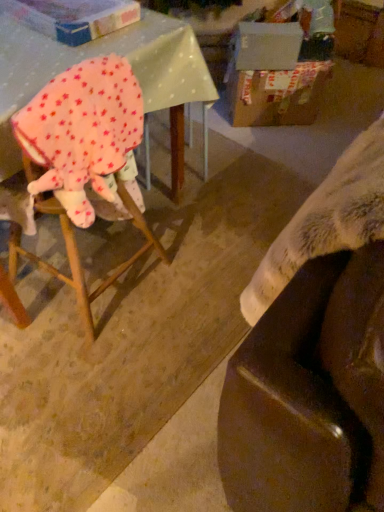
Question: Considering the relative sizes of wooden chair at left and fluffy white blanket at lower right in the image provided, is wooden chair at left wider than fluffy white blanket at lower right?

Choices:
 (A) yes
 (B) no

Answer: (A)

Question: From a real-world perspective, is wooden chair at left located beneath fluffy white blanket at lower right?

Choices:
 (A) no
 (B) yes

Answer: (B)

Question: Is fluffy white blanket at lower right surrounded by wooden chair at left?

Choices:
 (A) no
 (B) yes

Answer: (A)

Question: Can you confirm if wooden chair at left is positioned to the right of fluffy white blanket at lower right?

Choices:
 (A) yes
 (B) no

Answer: (B)

Question: From the image's perspective, would you say wooden chair at left is positioned over fluffy white blanket at lower right?

Choices:
 (A) yes
 (B) no

Answer: (A)

Question: Looking at the image, does pink fleece blanket at left seem bigger or smaller compared to wooden chair at left?

Choices:
 (A) small
 (B) big

Answer: (A)

Question: Is pink fleece blanket at left situated inside wooden chair at left or outside?

Choices:
 (A) inside
 (B) outside

Answer: (A)

Question: Looking at their shapes, would you say pink fleece blanket at left is wider or thinner than wooden chair at left?

Choices:
 (A) wide
 (B) thin

Answer: (B)

Question: Relative to wooden chair at left, is pink fleece blanket at left in front or behind?

Choices:
 (A) front
 (B) behind

Answer: (A)

Question: Is fluffy white blanket at lower right wider or thinner than cardboard box at upper right, which is the 2th cardboard box in left-to-right order?

Choices:
 (A) thin
 (B) wide

Answer: (A)

Question: In terms of size, does fluffy white blanket at lower right appear bigger or smaller than cardboard box at upper right, which is the first cardboard box in back-to-front order?

Choices:
 (A) small
 (B) big

Answer: (A)

Question: Does point (317, 189) appear closer or farther from the camera than point (317, 110)?

Choices:
 (A) closer
 (B) farther

Answer: (A)

Question: From the image's perspective, relative to cardboard box at upper right, which is the 2th cardboard box in left-to-right order, is fluffy white blanket at lower right above or below?

Choices:
 (A) below
 (B) above

Answer: (A)

Question: From a real-world perspective, is cardboard box at upper right, arranged as the second cardboard box when viewed from the front, physically located above or below cardboard box at upper left, the second cardboard box when ordered from back to front?

Choices:
 (A) below
 (B) above

Answer: (A)

Question: Considering the positions of cardboard box at upper right, arranged as the second cardboard box when viewed from the front, and cardboard box at upper left, the first cardboard box viewed from the left, in the image, is cardboard box at upper right, arranged as the second cardboard box when viewed from the front, bigger or smaller than cardboard box at upper left, the first cardboard box viewed from the left,?

Choices:
 (A) small
 (B) big

Answer: (B)